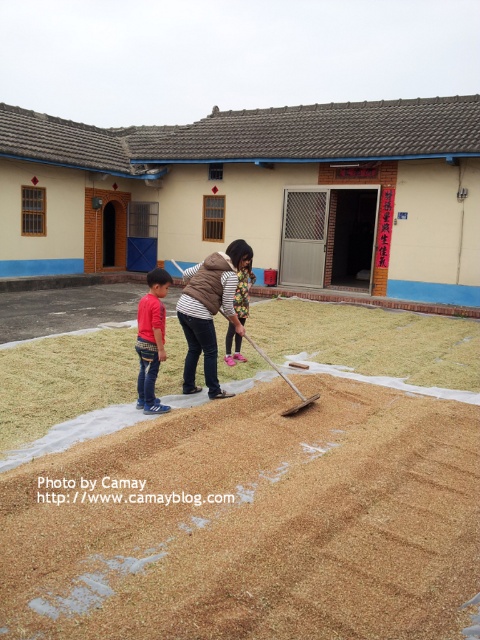
Question: Which point is farther from the camera taking this photo?

Choices:
 (A) (27, 483)
 (B) (140, 397)

Answer: (B)

Question: Can you confirm if brown grainy sand at lower center is positioned to the left of brown woolen vest at center?

Choices:
 (A) no
 (B) yes

Answer: (A)

Question: Which of the following is the closest to the observer?

Choices:
 (A) (252, 480)
 (B) (201, 298)

Answer: (A)

Question: Among these points, which one is farthest from the camera?

Choices:
 (A) (151, 273)
 (B) (279, 563)

Answer: (A)

Question: Can you confirm if brown woolen vest at center is wider than red cotton shirt at lower left?

Choices:
 (A) no
 (B) yes

Answer: (B)

Question: Does brown grainy sand at lower center come in front of red cotton shirt at lower left?

Choices:
 (A) yes
 (B) no

Answer: (A)